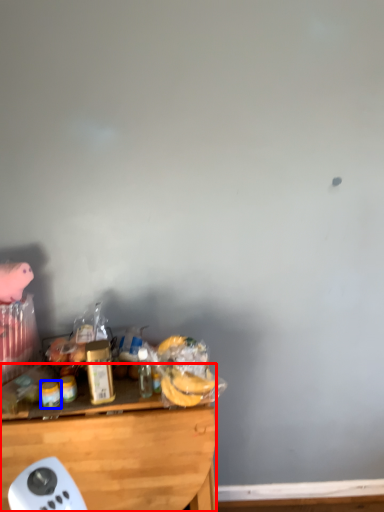
Question: Among these objects, which one is nearest to the camera, desk (highlighted by a red box) or food (highlighted by a blue box)?

Choices:
 (A) desk
 (B) food

Answer: (A)